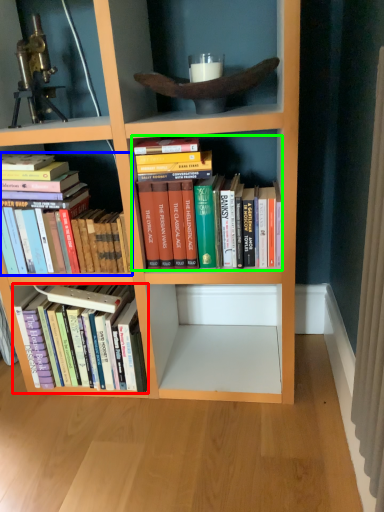
Question: Based on their relative distances, which object is nearer to book (highlighted by a red box)? Choose from book (highlighted by a blue box) and book (highlighted by a green box).

Choices:
 (A) book
 (B) book

Answer: (A)